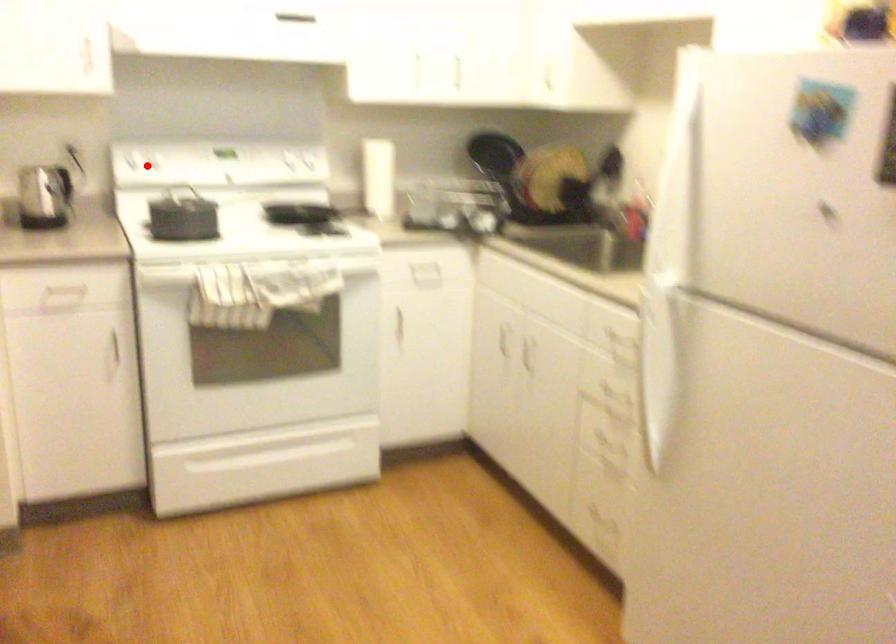
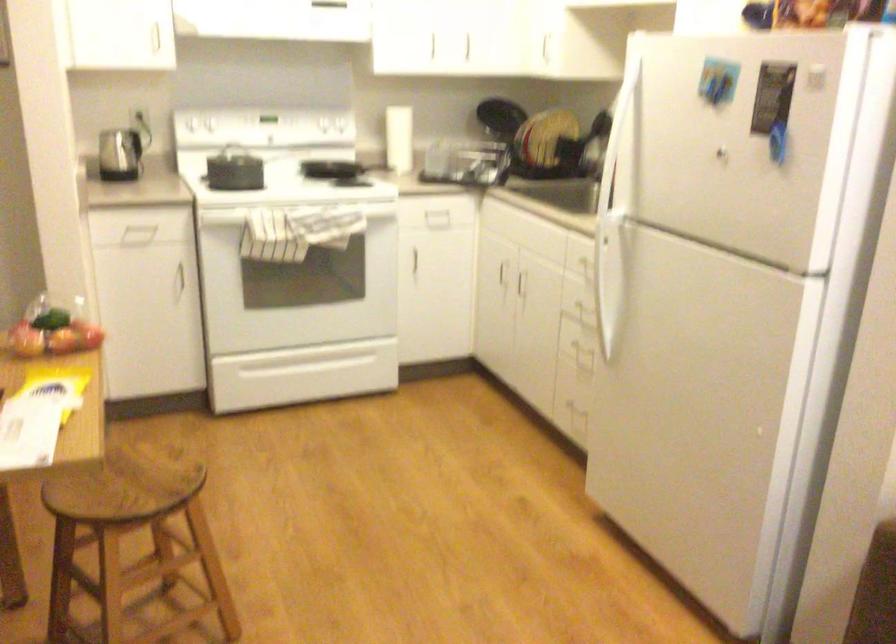
In the second image, find the point that corresponds to the highlighted location in the first image.

(200, 122)